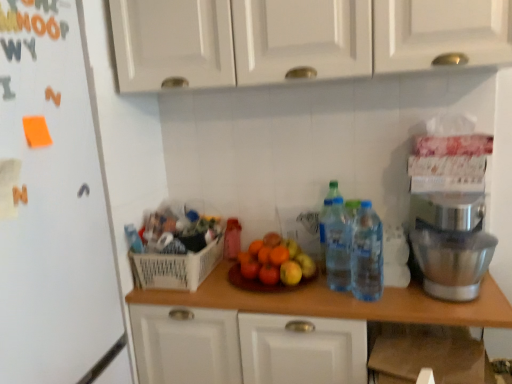
This screenshot has height=384, width=512. I want to click on vacant area that is in front of translucent plastic bottles at center, which appears as the 1th bottle when viewed from the front, so click(355, 304).